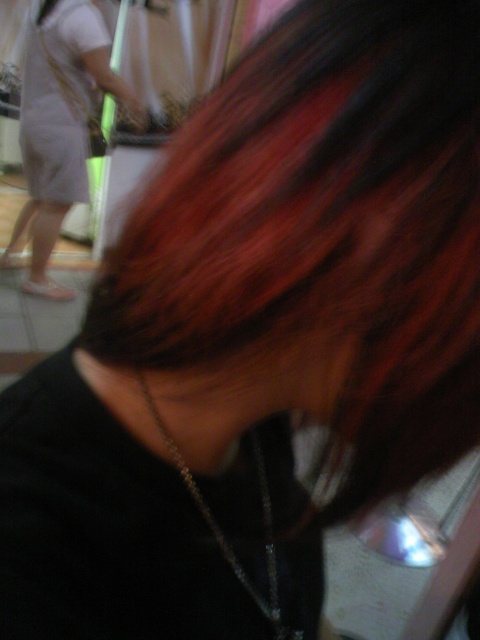
You are taking a photo of the person in the salon. You want to focus on the point closer to the camera. Which coordinate should you choose between point (344, 291) and point (298, 636)?

Point (344, 291) is closer to the camera than point (298, 636), so you should focus on point (344, 291).

You are a stylist trying to decide where to place a new accessory. You have the shiny dark brown hair at center and the silver metallic chain at center in view. Which object would you need to move if you want to place the accessory in the space between them?

Since the shiny dark brown hair at center is larger in size than the silver metallic chain at center, you would need to move the shiny dark brown hair at center to create space for the accessory between them.

From the picture: You are a fashion designer observing a photo of a person wearing a black top and a thin chain necklace. In the background, there is a matte white dress at upper left and a silver metallic chain at center. Which object is taller?

The matte white dress at upper left is much taller as silver metallic chain at center.